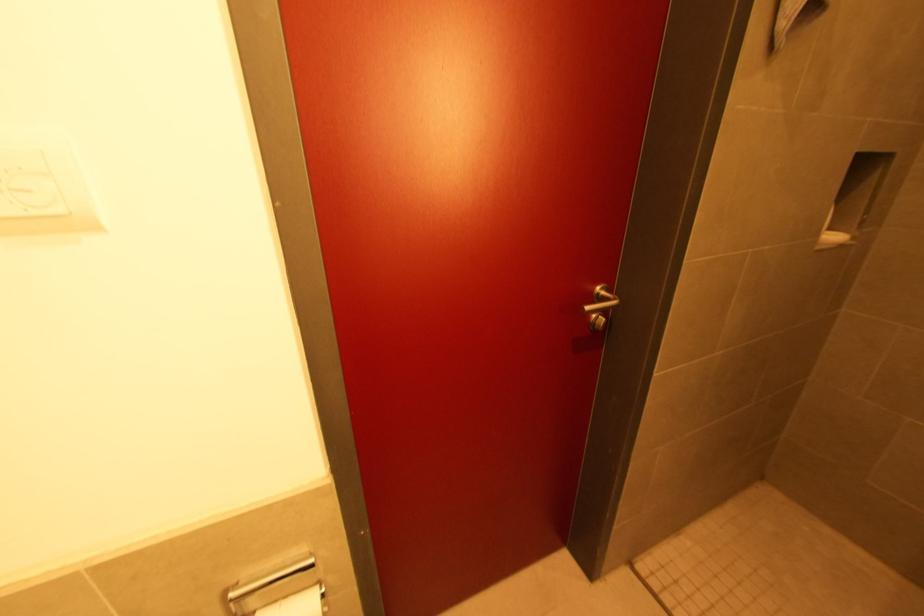
Where is `toilet paper holder`? toilet paper holder is located at coordinates (281, 592).